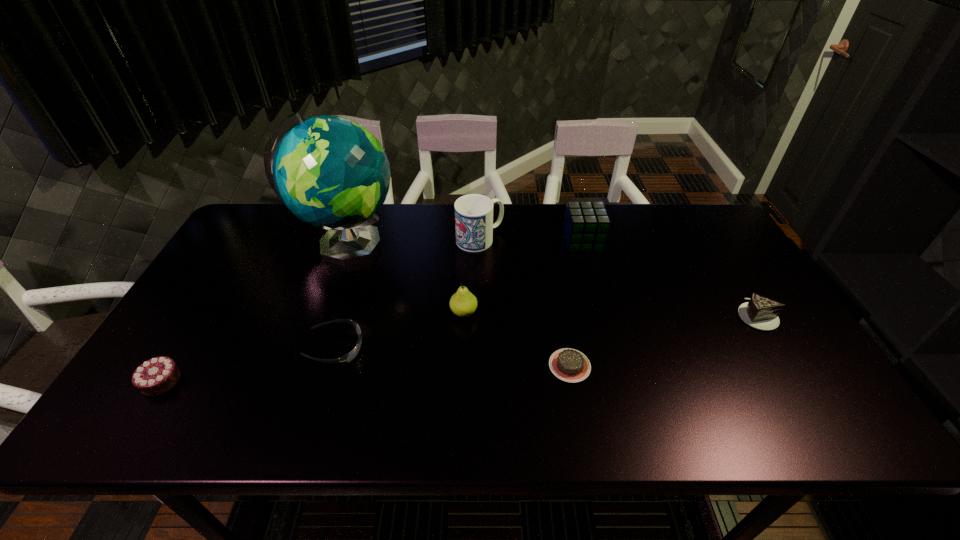
You are a GUI agent. You are given a task and a screenshot of the screen. Output one action in this format:
    pyautogui.click(x=<x>, y=<y>)
    Task: Click on the tallest object
    
    Given the screenshot: What is the action you would take?
    pyautogui.click(x=331, y=172)

Where is `mug`? The image size is (960, 540). mug is located at coordinates (474, 225).

This screenshot has width=960, height=540. I want to click on cube, so click(586, 225).

The height and width of the screenshot is (540, 960). Identify the location of pear. (463, 303).

Where is `the farthest chocolate cake`? The image size is (960, 540). the farthest chocolate cake is located at coordinates (760, 312).

You are a GUI agent. You are given a task and a screenshot of the screen. Output one action in this format:
    pyautogui.click(x=<x>, y=<y>)
    Task: Click on the rightmost chocolate cake
    The height and width of the screenshot is (540, 960).
    Given the screenshot: What is the action you would take?
    pyautogui.click(x=760, y=312)

The image size is (960, 540). In order to click on the leftmost chocolate cake in this screenshot , I will do pyautogui.click(x=156, y=376).

Find the location of a particular element. Image resolution: width=960 pixels, height=540 pixels. the seventh tallest object is located at coordinates (349, 357).

Locate an element on the screen. This screenshot has width=960, height=540. the second chocolate cake from right to left is located at coordinates (570, 365).

Locate an element on the screen. The height and width of the screenshot is (540, 960). the shortest chocolate cake is located at coordinates (570, 365).